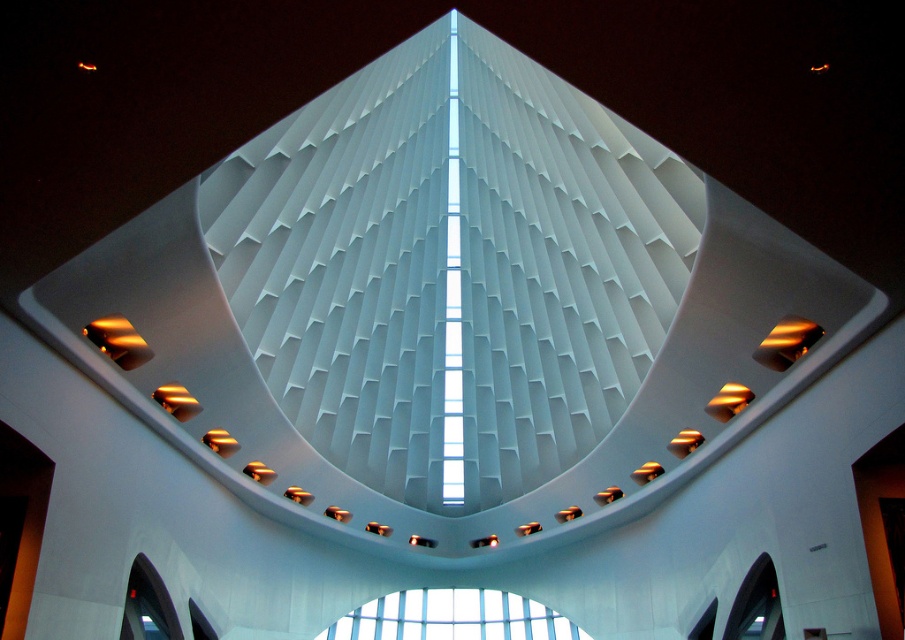
You are an architect designing a new building and want to ensure that the clear glass window at center and the transparent glass window at lower right are arranged correctly according to the design plans. Based on the scene description, which window is placed to the left of the other?

The clear glass window at center is positioned on the left side of transparent glass window at lower right.

You are an interior designer assessing the lighting in the space. You notice the clear glass window at center and the transparent glass window at lower right. Which window allows more natural light into the room based on their sizes?

The clear glass window at center allows more natural light into the room because its width surpasses that of the transparent glass window at lower right, meaning it has a larger surface area to let in light.

You are standing inside the modern architectural structure and want to determine the relative positions of two points marked on the ceiling. The first point is labeled as point (365, 620) and the second as point (740, 604). Based on the ceiling design described, which point is closer to you?

Point (365, 620) is further to the viewer than point (740, 604), so the latter point is closer to you.